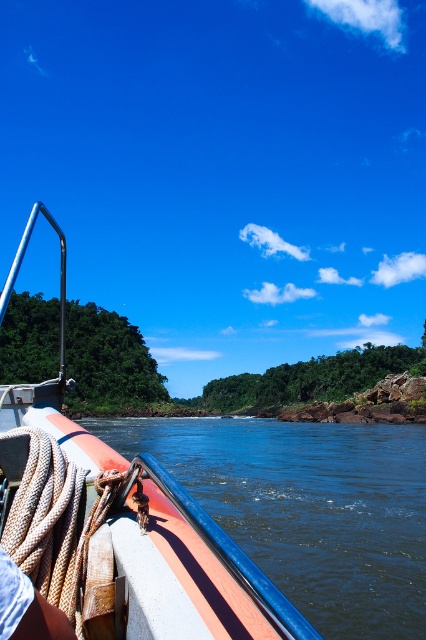
Question: Is orange rubber boat at left to the left of smooth rubber boat at lower left from the viewer's perspective?

Choices:
 (A) no
 (B) yes

Answer: (B)

Question: Is orange rubber boat at left behind smooth rubber boat at lower left?

Choices:
 (A) yes
 (B) no

Answer: (B)

Question: Which point is closer to the camera?

Choices:
 (A) (344, 449)
 (B) (11, 538)

Answer: (B)

Question: Is the position of orange rubber boat at left less distant than that of smooth rubber boat at lower left?

Choices:
 (A) yes
 (B) no

Answer: (A)